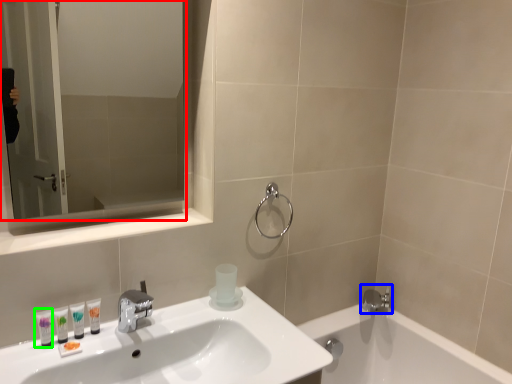
Question: Considering the real-world distances, which object is closest to mirror (highlighted by a red box)? tap (highlighted by a blue box) or mouthwash (highlighted by a green box).

Choices:
 (A) tap
 (B) mouthwash

Answer: (B)